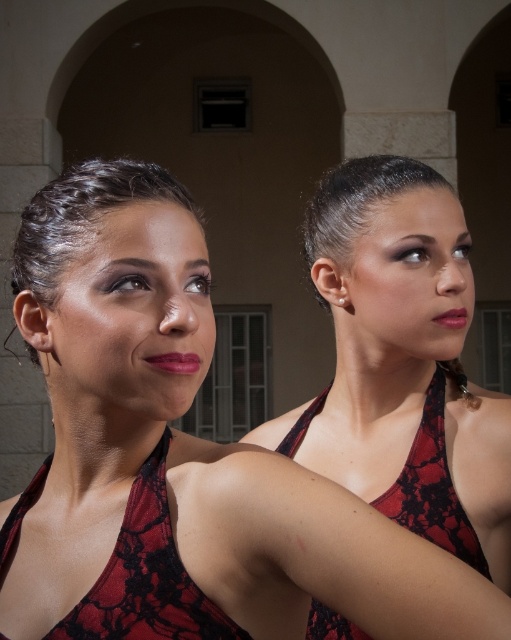
You are a photographer setting up a shoot in a room with an arched doorway and a wall with a rectangular opening. You have two dresses to feature in your photoshoot, the lace fabric dress at center and the red lace dress at center. According to the scene, which dress should you place higher to ensure they are arranged as shown?

The lace fabric dress at center should be placed higher since it is above the red lace dress at center in the scene.